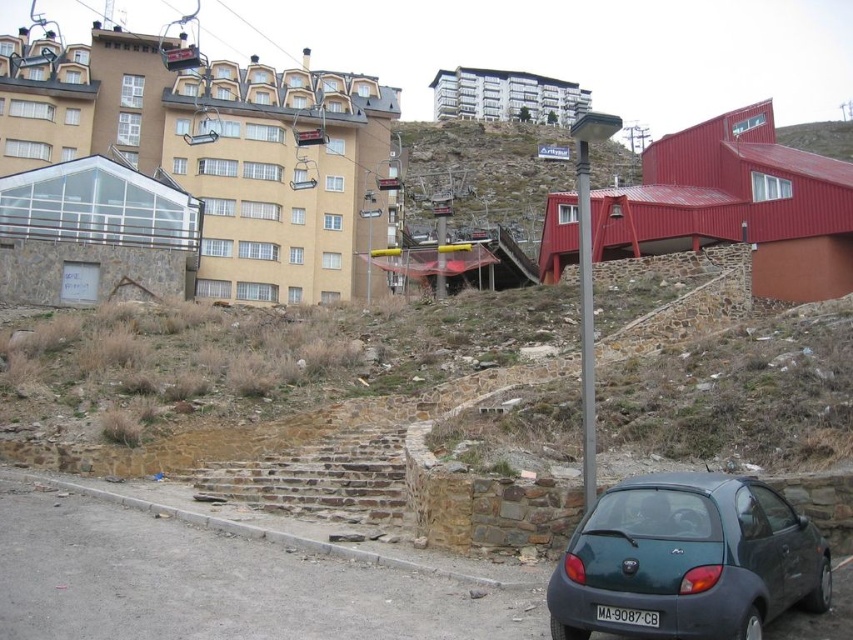
You are standing in front of the urban scene described. There are two points marked in the image, one at coordinates point (314, 506) and the other at point (587, 195). Which of these two points is closer to your viewpoint?

Point (314, 506) is further to the camera than point (587, 195), so the point closer to your viewpoint is point (587, 195).

You are a delivery person standing at the black plastic license plate at lower center. You need to reach the top of the brown stone stairs at center to drop off a package. What is the minimum distance you must walk to reach the stairs?

The minimum distance you must walk to reach the brown stone stairs at center from the black plastic license plate at lower center is 20.21 meters.

You are standing at the point closest to the camera in the image. Which of the two points, point (341, 454) or point (625, 611), is closer to you?

Point (341, 454) is closer to you because it is further to the viewer than point (625, 611).